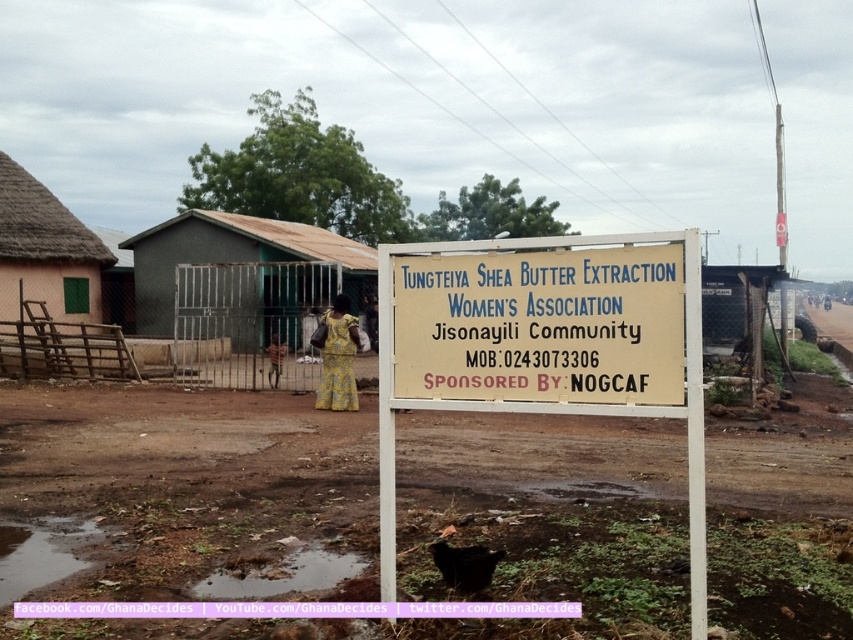
You are standing at the center of the image and want to walk to the thatched straw hut at left. According to the coordinates provided in the Objects Description, in which general direction should you head?

The thatched straw hut at left is located at point (45,252), which means it is positioned to the left and slightly forward from the center. Therefore, you should head to the left and slightly forward to reach it.

You are standing in front of the signboard at TUNGTEIYA SHEA BUTTER EXTRACTION WOMEN ASSOCIATION. You notice two points marked on the signboard. The first point is at coordinate point(380,301) and the second point is at coordinate point(453,554). If you want to touch the point that is nearer to you, which coordinate should you choose?

You should choose the point at coordinate point(380,301) because it is closer to the camera than point(453,554).